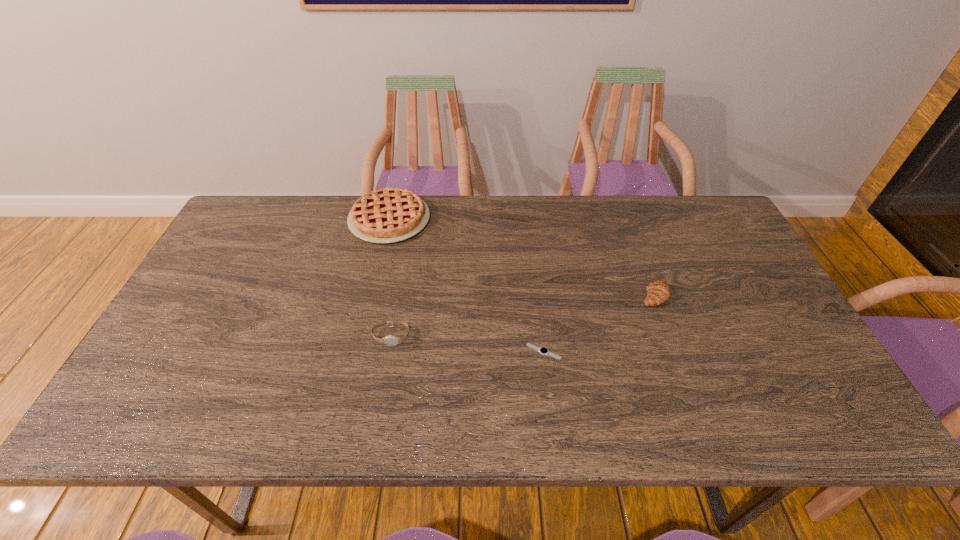
I want to click on pie, so click(x=388, y=215).

Locate an element on the screen. the tallest object is located at coordinates (388, 215).

The width and height of the screenshot is (960, 540). Find the location of `the second farthest object`. the second farthest object is located at coordinates (658, 292).

Locate an element on the screen. crescent roll is located at coordinates (658, 292).

Find the location of a particular element. The width and height of the screenshot is (960, 540). the left watch is located at coordinates (390, 340).

Locate an element on the screen. The width and height of the screenshot is (960, 540). the shorter watch is located at coordinates (542, 350).

Where is `the shortest object`? The image size is (960, 540). the shortest object is located at coordinates (542, 350).

Where is `vacant region located 0.070m on the front of the pie`? vacant region located 0.070m on the front of the pie is located at coordinates (380, 262).

Where is `free location located on the left of the third nearest object`? free location located on the left of the third nearest object is located at coordinates (600, 294).

You are a GUI agent. You are given a task and a screenshot of the screen. Output one action in this format:
    pyautogui.click(x=<x>, y=<y>)
    Task: Click on the vacant space positioned 0.210m on the face of the left watch
    The height and width of the screenshot is (540, 960).
    Given the screenshot: What is the action you would take?
    pyautogui.click(x=375, y=428)